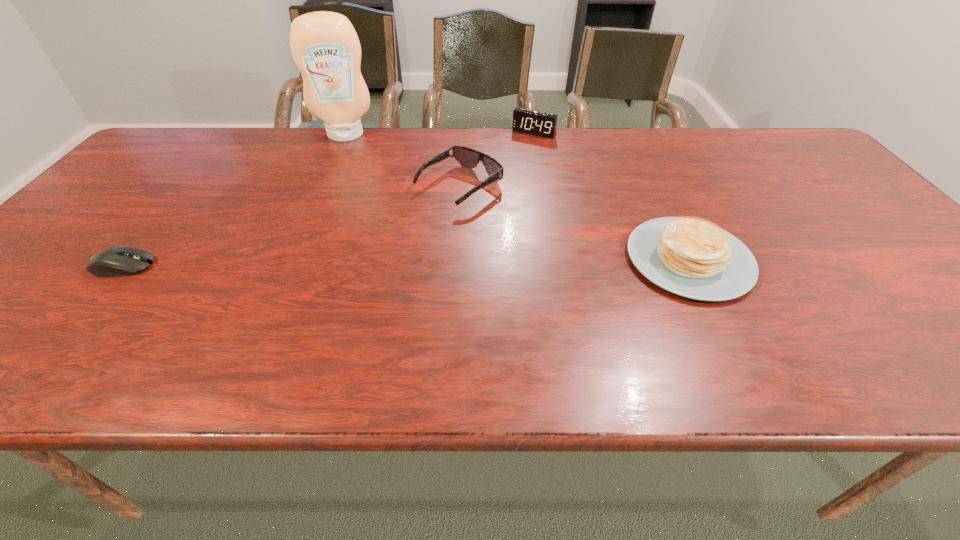
Locate an element on the screen. The image size is (960, 540). free space on the desktop that is between the computer mouse and the pancake and is positioned on the front-facing side of the third object from left to right is located at coordinates (343, 264).

Where is `vacant space on the desktop that is between the leftmost object and the rightmost object and is positioned on the label of the condiment`? vacant space on the desktop that is between the leftmost object and the rightmost object and is positioned on the label of the condiment is located at coordinates (342, 264).

Find the location of a particular element. The image size is (960, 540). free space on the desktop that is between the leftmost object and the rightmost object and is positioned on the front-facing side of the alarm clock is located at coordinates (444, 262).